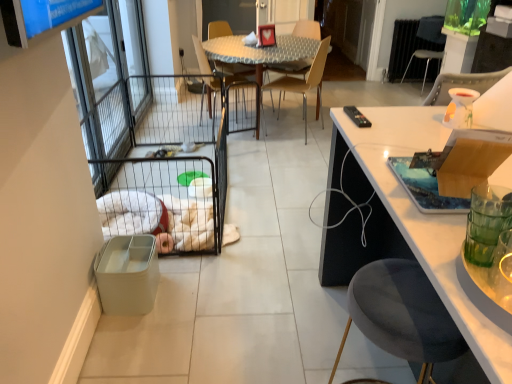
Question: Is clear glass screen door at left wider or thinner than wooden cutting board at right?

Choices:
 (A) wide
 (B) thin

Answer: (B)

Question: Considering the positions of clear glass screen door at left and wooden cutting board at right in the image, is clear glass screen door at left taller or shorter than wooden cutting board at right?

Choices:
 (A) tall
 (B) short

Answer: (A)

Question: Estimate the real-world distances between objects in this image. Which object is closer to the metallic silver chair at upper right, the first chair in the back-to-front sequence?

Choices:
 (A) metallic silver chair at center, the first chair when ordered from left to right
 (B) metallic patterned table at center
 (C) matte plastic trash bin at lower left
 (D) wooden cutting board at right
 (E) clear glass screen door at left

Answer: (B)

Question: Which of these objects is positioned farthest from the matte plastic trash bin at lower left?

Choices:
 (A) metallic patterned table at center
 (B) metallic silver chair at upper right, which is the 4th chair in bottom-to-top order
 (C) light brown wood chair at center, which ranks as the second chair in front-to-back order
 (D) metallic silver chair at center, the first chair when ordered from left to right
 (E) wooden cutting board at right

Answer: (B)